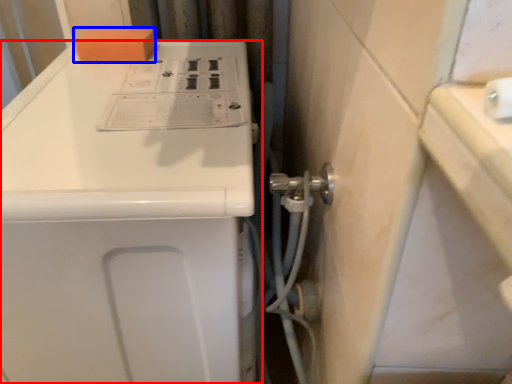
Question: Which object appears farthest to the camera in this image, home appliance (highlighted by a red box) or soap (highlighted by a blue box)?

Choices:
 (A) home appliance
 (B) soap

Answer: (B)